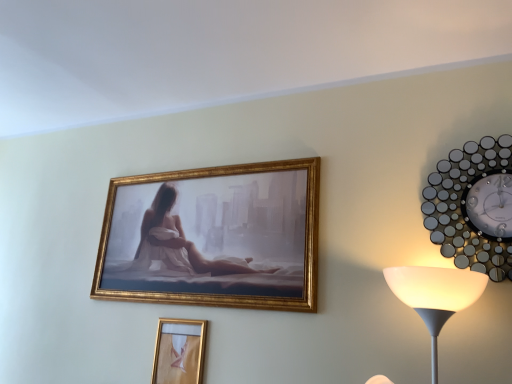
Question: Is metallic silver wall clock at right facing away from gold metallic picture frame at lower center?

Choices:
 (A) yes
 (B) no

Answer: (B)

Question: Is metallic silver wall clock at right completely or partially outside of gold metallic picture frame at lower center?

Choices:
 (A) yes
 (B) no

Answer: (A)

Question: Is metallic silver wall clock at right facing towards gold metallic picture frame at lower center?

Choices:
 (A) no
 (B) yes

Answer: (A)

Question: Is metallic silver wall clock at right at the left side of gold metallic picture frame at lower center?

Choices:
 (A) yes
 (B) no

Answer: (B)

Question: Can you confirm if metallic silver wall clock at right is taller than gold metallic picture frame at lower center?

Choices:
 (A) no
 (B) yes

Answer: (B)

Question: Is gold metallic picture frame at lower center surrounded by metallic silver wall clock at right?

Choices:
 (A) no
 (B) yes

Answer: (A)

Question: Is gold metallic picture frame at lower center oriented away from metallic silver wall clock at right?

Choices:
 (A) no
 (B) yes

Answer: (A)

Question: Is gold metallic picture frame at lower center shorter than metallic silver wall clock at right?

Choices:
 (A) no
 (B) yes

Answer: (B)

Question: Can you see gold metallic picture frame at lower center touching metallic silver wall clock at right?

Choices:
 (A) no
 (B) yes

Answer: (A)

Question: Can you confirm if gold metallic picture frame at lower center is thinner than metallic silver wall clock at right?

Choices:
 (A) yes
 (B) no

Answer: (A)

Question: Does gold metallic picture frame at lower center have a greater width compared to metallic silver wall clock at right?

Choices:
 (A) yes
 (B) no

Answer: (B)

Question: Is gold metallic picture frame at lower center at the left side of metallic silver wall clock at right?

Choices:
 (A) yes
 (B) no

Answer: (A)

Question: Would you say metallic silver wall clock at right is to the left or to the right of gold metallic picture frame at lower center in the picture?

Choices:
 (A) right
 (B) left

Answer: (A)